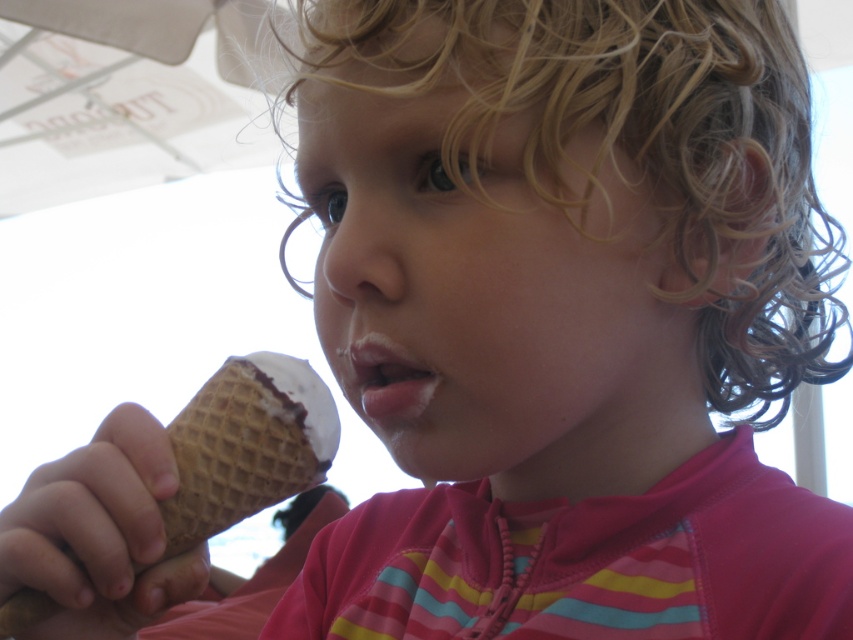
Question: Among these objects, which one is farthest from the camera?

Choices:
 (A) waffle cone ice cream at lower left
 (B) pink matte lips at center

Answer: (B)

Question: Observing the image, what is the correct spatial positioning of waffle cone ice cream at lower left in reference to pink matte lips at center?

Choices:
 (A) below
 (B) above

Answer: (A)

Question: Which point is closer to the camera?

Choices:
 (A) pink matte lips at center
 (B) waffle cone ice cream at lower left

Answer: (B)

Question: Can you confirm if waffle cone ice cream at lower left is positioned to the right of pink matte lips at center?

Choices:
 (A) yes
 (B) no

Answer: (B)

Question: Is waffle cone ice cream at lower left below pink matte lips at center?

Choices:
 (A) yes
 (B) no

Answer: (A)